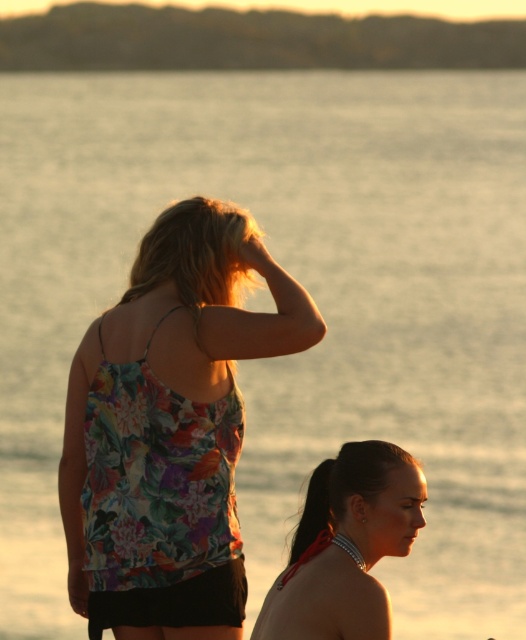
Question: Among these points, which one is farthest from the camera?

Choices:
 (A) (217, 397)
 (B) (361, 481)

Answer: (B)

Question: From the image, what is the correct spatial relationship of floral fabric tank top at upper left in relation to floral print fabric bikini top at upper left?

Choices:
 (A) above
 (B) below

Answer: (A)

Question: Which point is closer to the camera?

Choices:
 (A) (336, 632)
 (B) (224, 572)
 (C) (129, 544)

Answer: (A)

Question: Among these points, which one is farthest from the camera?

Choices:
 (A) (157, 532)
 (B) (348, 582)
 (C) (130, 532)

Answer: (A)

Question: Does floral print fabric bikini top at upper left have a smaller size compared to matte floral tank top at lower center?

Choices:
 (A) yes
 (B) no

Answer: (A)

Question: Is floral fabric tank top at upper left further to the viewer compared to floral print fabric bikini top at upper left?

Choices:
 (A) yes
 (B) no

Answer: (B)